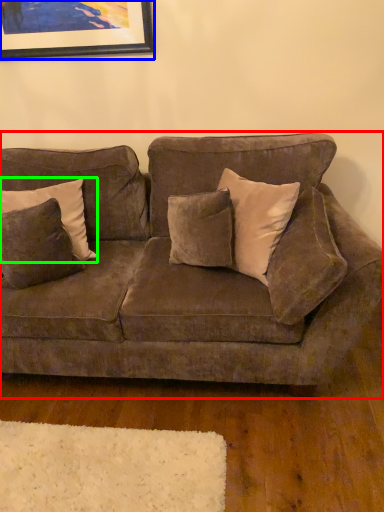
Question: Based on their relative distances, which object is farther from studio couch (highlighted by a red box)? Choose from picture frame (highlighted by a blue box) and pillow (highlighted by a green box).

Choices:
 (A) picture frame
 (B) pillow

Answer: (A)